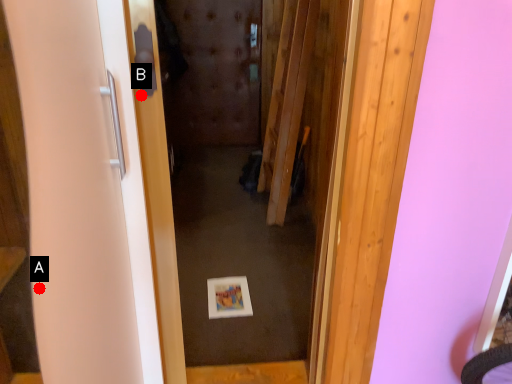
Question: Two points are circled on the image, labeled by A and B beside each circle. Which of the following is the closest to the observer?

Choices:
 (A) A is closer
 (B) B is closer

Answer: (A)